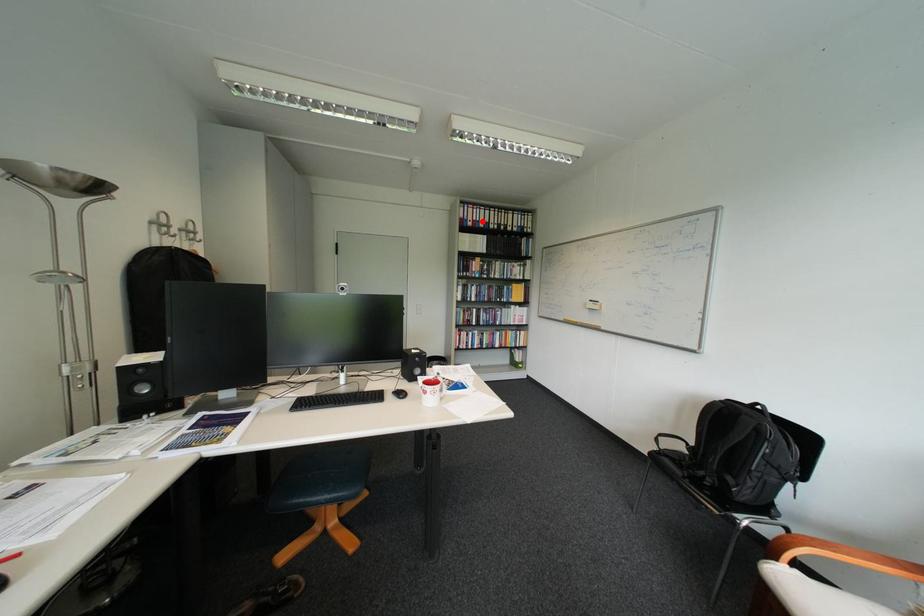
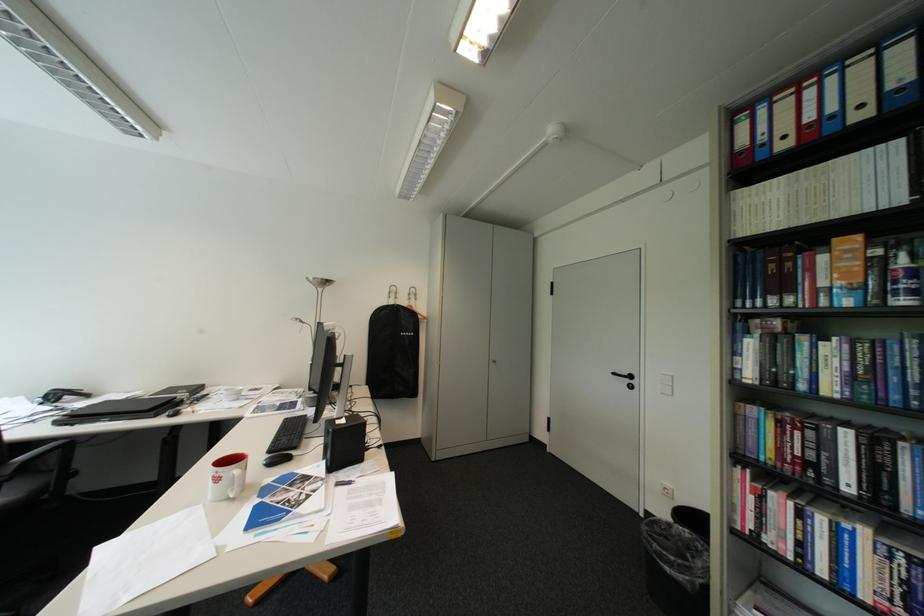
Question: I am providing you with two images of the same scene from different viewpoints. In image1, a red point is highlighted. Considering the same 3D point in image2, which of the following is correct?

Choices:
 (A) It is closer
 (B) It is farther

Answer: (B)